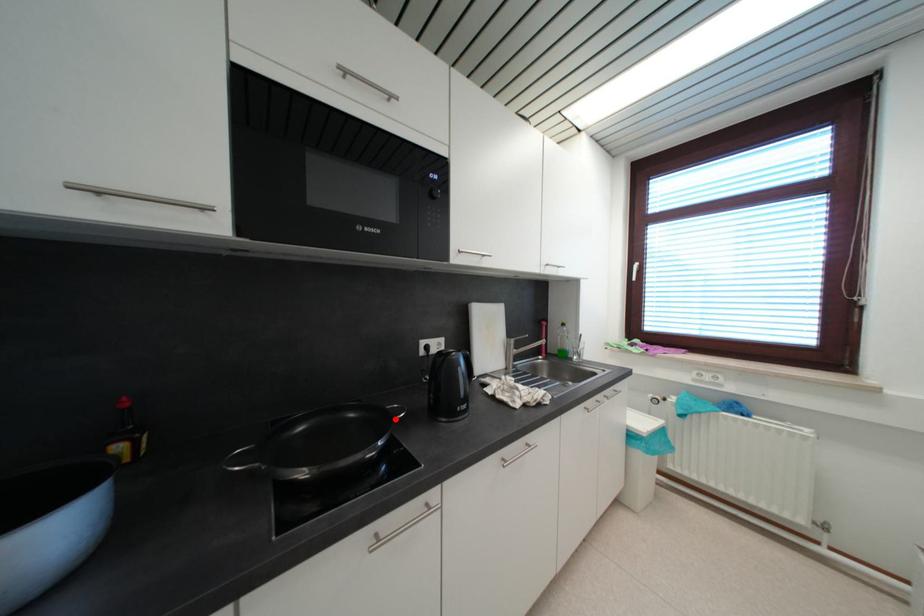
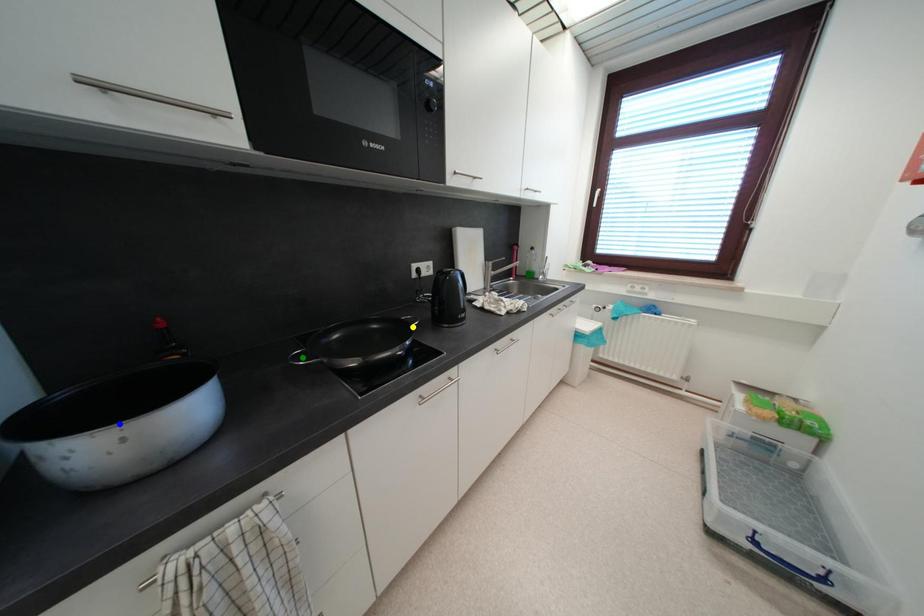
Question: I am providing you with two images of the same scene from different viewpoints. A red point is marked on the first image. You are given multiple points on the second image. Which mark in image 2 goes with the point in image 1?

Choices:
 (A) green point
 (B) yellow point
 (C) blue point

Answer: (B)